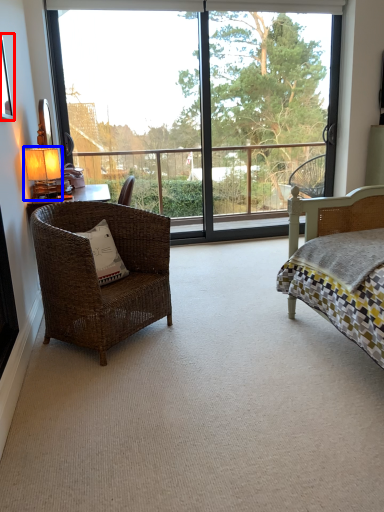
Question: Which point is further to the camera, picture frame (highlighted by a red box) or table lamp (highlighted by a blue box)?

Choices:
 (A) picture frame
 (B) table lamp

Answer: (B)